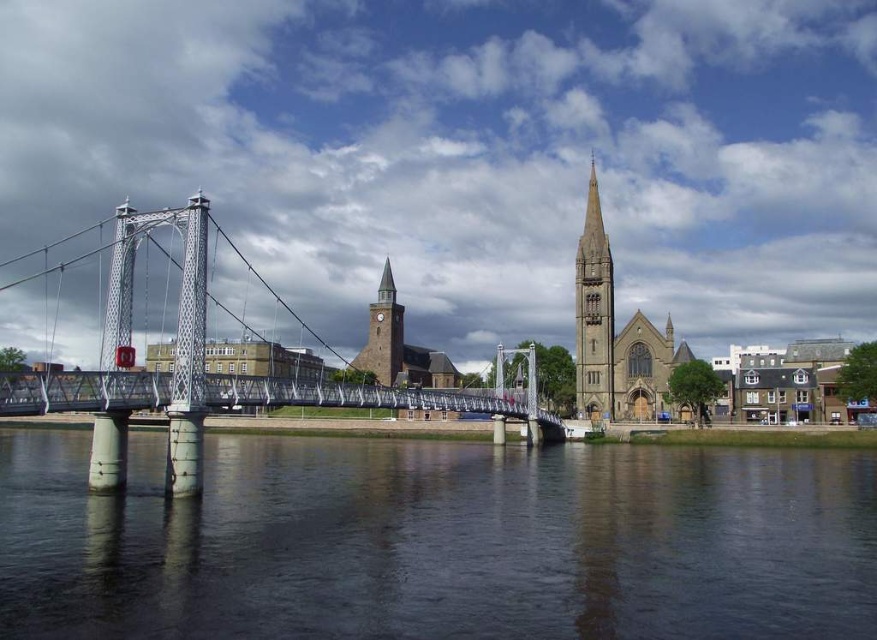
Question: Is gray stone spire at center positioned behind brown stone clock tower at center?

Choices:
 (A) no
 (B) yes

Answer: (A)

Question: Which of the following is the farthest from the observer?

Choices:
 (A) (400, 353)
 (B) (212, 593)
 (C) (604, 305)

Answer: (A)

Question: Is the position of dark water at center more distant than that of brown stone church at center?

Choices:
 (A) no
 (B) yes

Answer: (A)

Question: Among these objects, which one is nearest to the camera?

Choices:
 (A) brown stone clock tower at center
 (B) dark water at center
 (C) metallic suspension bridge at left

Answer: (B)

Question: Can you confirm if dark water at center is bigger than brown stone church at center?

Choices:
 (A) no
 (B) yes

Answer: (B)

Question: Which is farther from the brown stone clock tower at center?

Choices:
 (A) gray stone spire at center
 (B) metallic suspension bridge at left
 (C) dark water at center
 (D) brown stone church at center

Answer: (C)